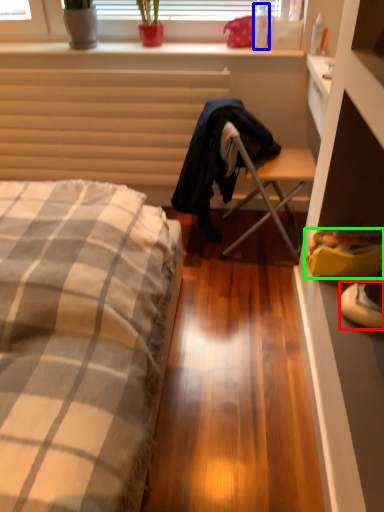
Question: Considering the real-world distances, which object is closest to sneakers (highlighted by a red box)? bottle (highlighted by a blue box) or handbag (highlighted by a green box).

Choices:
 (A) bottle
 (B) handbag

Answer: (B)